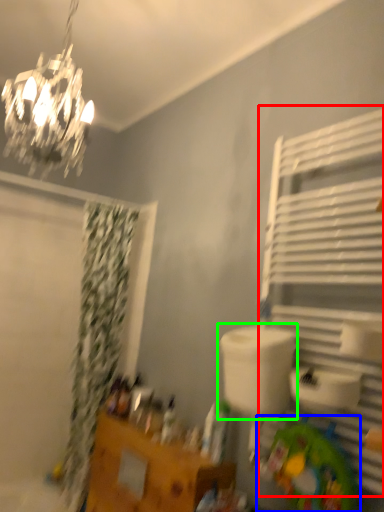
Question: Which object is positioned farthest from shelf (highlighted by a red box)? Select from toy (highlighted by a blue box) and sink (highlighted by a green box).

Choices:
 (A) toy
 (B) sink

Answer: (A)